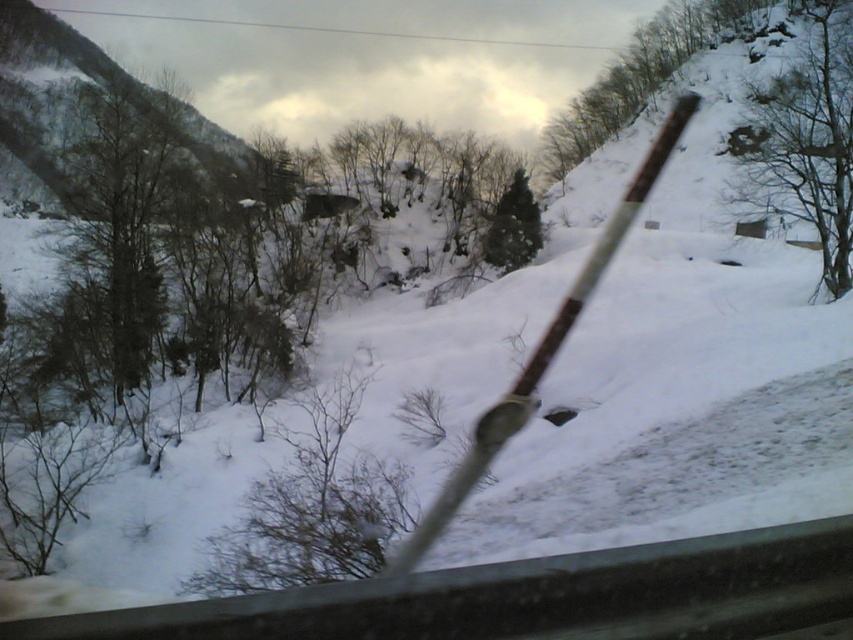
Which of these two, brown textured tree at upper right or green leafy tree at upper center, stands taller?

brown textured tree at upper right is taller.

Does brown textured tree at upper right have a lesser height compared to green leafy tree at upper center?

Incorrect, brown textured tree at upper right's height does not fall short of green leafy tree at upper center's.

Locate an element on the screen. This screenshot has width=853, height=640. brown textured tree at upper right is located at coordinates (805, 140).

Can you confirm if brown textured bush at center is positioned below green matte tree at center?

Yes.

The width and height of the screenshot is (853, 640). I want to click on brown textured bush at center, so click(311, 508).

Does brown textured bush at center appear over brown textured tree at upper right?

No, brown textured bush at center is not above brown textured tree at upper right.

Is point (306, 580) closer to viewer compared to point (811, 196)?

Yes, point (306, 580) is in front of point (811, 196).

The height and width of the screenshot is (640, 853). Find the location of `brown textured bush at center`. brown textured bush at center is located at coordinates [311, 508].